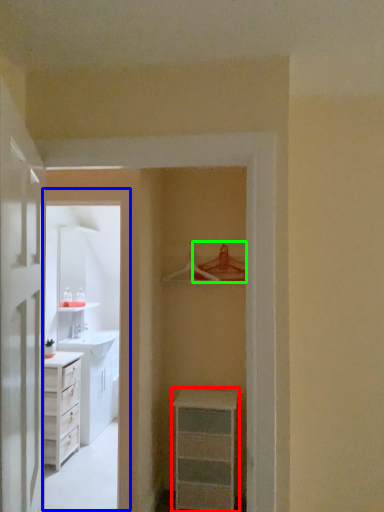
Question: Which is farther away from chest of drawers (highlighted by a red box)? corridor (highlighted by a blue box) or hanger (highlighted by a green box)?

Choices:
 (A) corridor
 (B) hanger

Answer: (B)